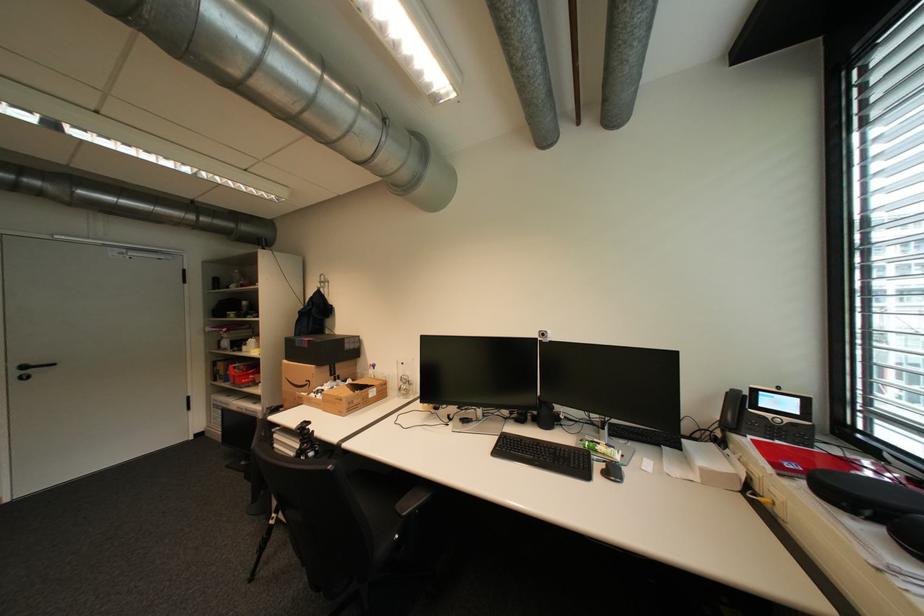
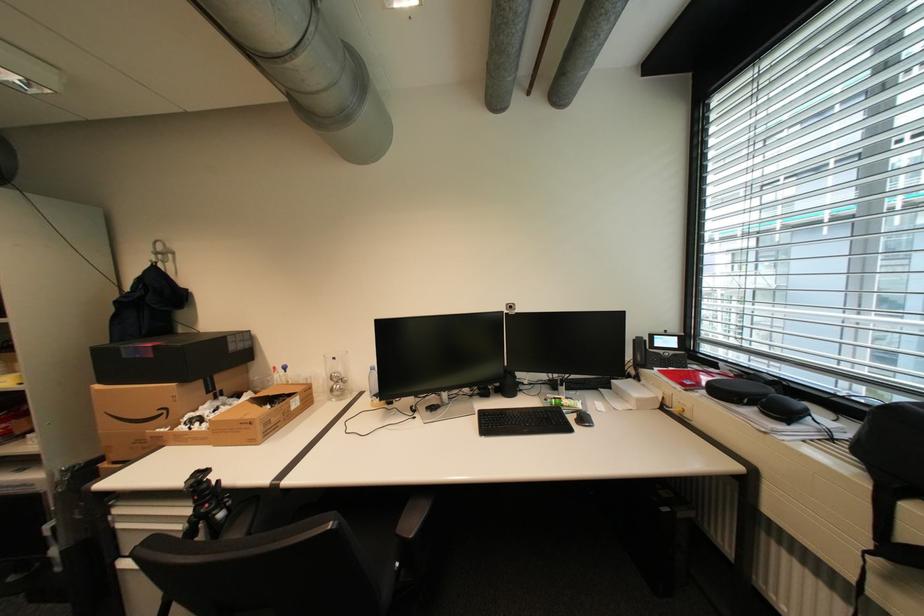
Find the pixel in the second image that matches [436,496] in the first image.

(439, 503)